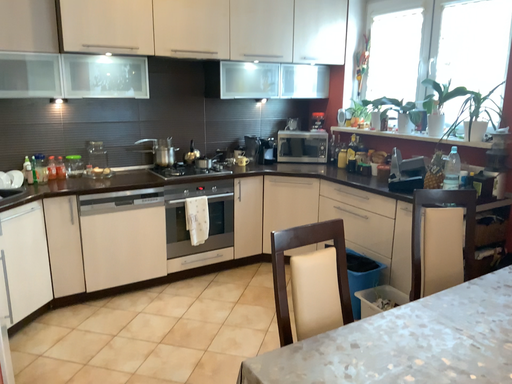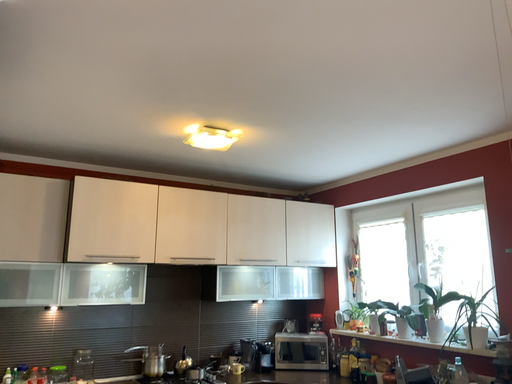
Question: How did the camera likely rotate when shooting the video?

Choices:
 (A) rotated upward
 (B) rotated downward

Answer: (A)